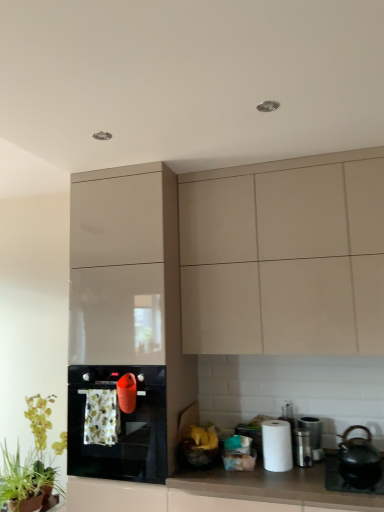
Where is `free space in front of white paper at right`? The width and height of the screenshot is (384, 512). free space in front of white paper at right is located at coordinates (273, 480).